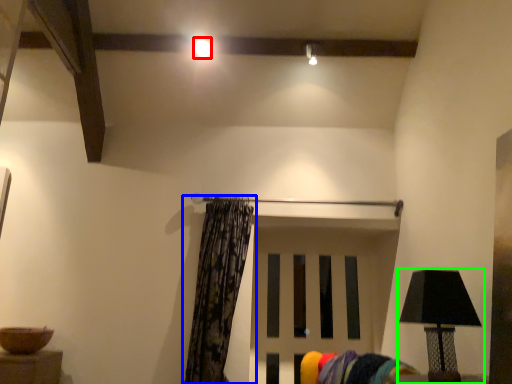
Question: Estimate the real-world distances between objects in this image. Which object is closer to lighting (highlighted by a red box), curtain (highlighted by a blue box) or lamp (highlighted by a green box)?

Choices:
 (A) curtain
 (B) lamp

Answer: (A)